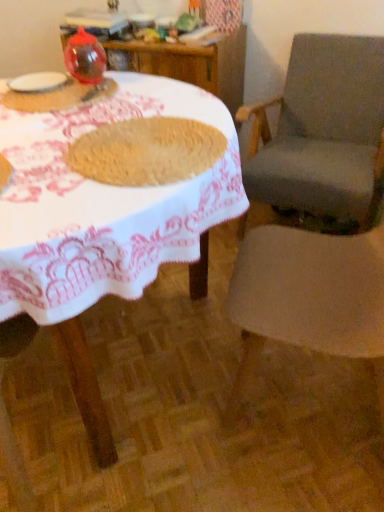
This screenshot has width=384, height=512. Identify the location of unoccupied area in front of transparent plastic balloon at upper left, placed as the third tableware when sorted from bottom to top. (78, 97).